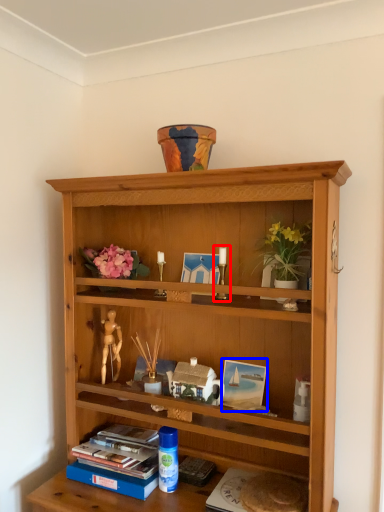
Question: Which of the following is the closest to the observer, candle holder (highlighted by a red box) or picture frame (highlighted by a blue box)?

Choices:
 (A) candle holder
 (B) picture frame

Answer: (A)